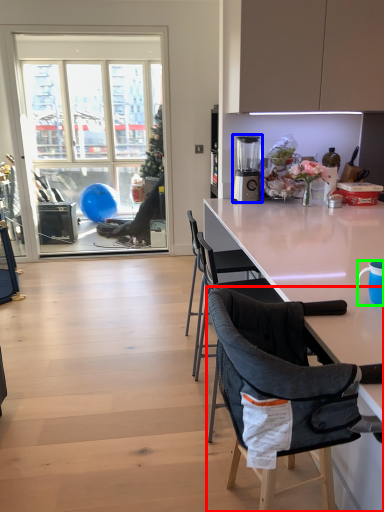
Question: Based on their relative distances, which object is farther from chair (highlighted by a red box)? Choose from blender (highlighted by a blue box) and coffee cup (highlighted by a green box).

Choices:
 (A) blender
 (B) coffee cup

Answer: (A)